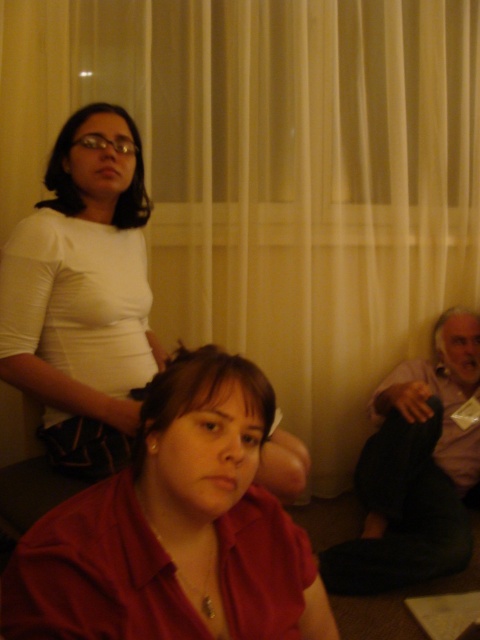
Question: Which point appears closest to the camera in this image?

Choices:
 (A) (452, 465)
 (B) (98, 584)
 (C) (151, 339)

Answer: (B)

Question: Is matte red shirt at center to the left of matte white shirt at upper left from the viewer's perspective?

Choices:
 (A) no
 (B) yes

Answer: (A)

Question: Among these objects, which one is nearest to the camera?

Choices:
 (A) light pink fabric shirt at lower right
 (B) matte white shirt at upper left
 (C) matte red shirt at center

Answer: (C)

Question: Is matte red shirt at center closer to the viewer compared to matte white shirt at upper left?

Choices:
 (A) no
 (B) yes

Answer: (B)

Question: Does matte red shirt at center appear under light pink fabric shirt at lower right?

Choices:
 (A) yes
 (B) no

Answer: (B)

Question: Based on their relative distances, which object is nearer to the matte red shirt at center?

Choices:
 (A) matte white shirt at upper left
 (B) light pink fabric shirt at lower right

Answer: (A)